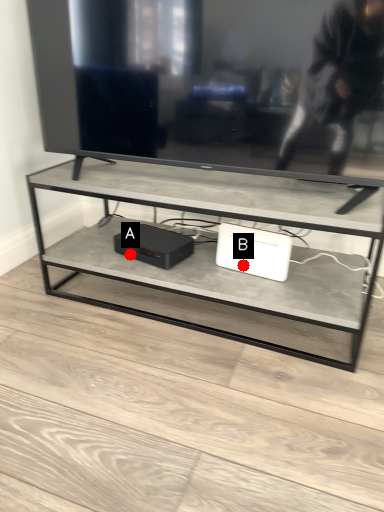
Question: Two points are circled on the image, labeled by A and B beside each circle. Among these points, which one is farthest from the camera?

Choices:
 (A) A is further
 (B) B is further

Answer: (A)